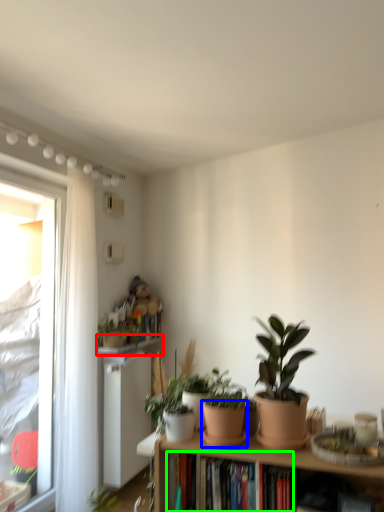
Question: Estimate the real-world distances between objects in this image. Which object is farther from window sill (highlighted by a red box), flowerpot (highlighted by a blue box) or book (highlighted by a green box)?

Choices:
 (A) flowerpot
 (B) book

Answer: (A)